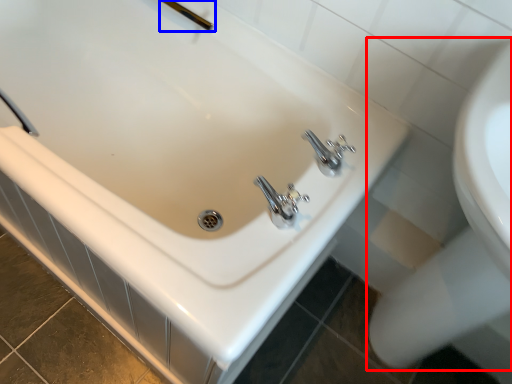
Question: Which object appears closest to the camera in this image, sink (highlighted by a red box) or shower (highlighted by a blue box)?

Choices:
 (A) sink
 (B) shower

Answer: (A)